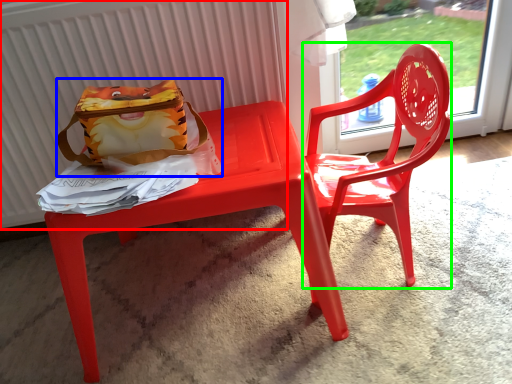
Question: Which object is positioned closest to radiator (highlighted by a red box)? Select from pouch (highlighted by a blue box) and chair (highlighted by a green box).

Choices:
 (A) pouch
 (B) chair

Answer: (A)